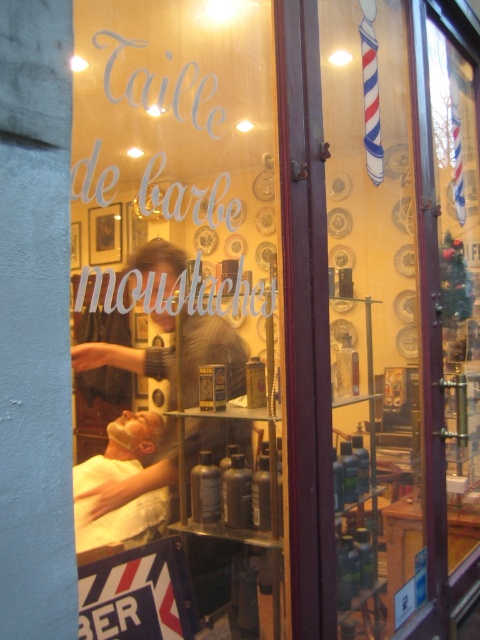
You are a customer entering the barbershop and see the matte glass sign at center and the white cloth at lower left. Which object is taller?

The matte glass sign at center is taller than the white cloth at lower left.